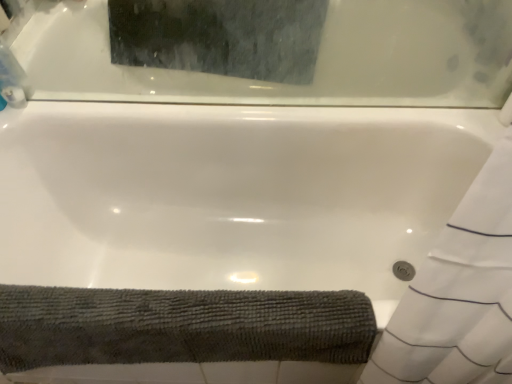
The width and height of the screenshot is (512, 384). I want to click on white glossy bathtub at upper center, so click(316, 63).

Find the location of a particular element. The height and width of the screenshot is (384, 512). dark gray textured bath towel at lower left is located at coordinates (180, 326).

The image size is (512, 384). Describe the element at coordinates (13, 79) in the screenshot. I see `clear plastic bottle at upper left` at that location.

Identify the location of white glossy bathtub at upper center. (316, 63).

Who is bigger, clear plastic bottle at upper left or white glossy bathtub at upper center?

With larger size is white glossy bathtub at upper center.

Looking at this image, from a real-world perspective, does clear plastic bottle at upper left sit lower than white glossy bathtub at upper center?

Indeed, from a real-world perspective, clear plastic bottle at upper left is positioned beneath white glossy bathtub at upper center.

Who is taller, clear plastic bottle at upper left or white glossy bathtub at upper center?

Standing taller between the two is white glossy bathtub at upper center.

Would you say clear plastic bottle at upper left is inside or outside dark gray textured bath towel at lower left?

The correct answer is: outside.

Which of these two, clear plastic bottle at upper left or dark gray textured bath towel at lower left, is thinner?

With smaller width is clear plastic bottle at upper left.

Is the position of clear plastic bottle at upper left more distant than that of dark gray textured bath towel at lower left?

Yes, it is behind dark gray textured bath towel at lower left.

Based on their positions, is clear plastic bottle at upper left located to the left or right of dark gray textured bath towel at lower left?

From the image, it's evident that clear plastic bottle at upper left is to the left of dark gray textured bath towel at lower left.

Considering the relative sizes of dark gray textured bath towel at lower left and clear plastic bottle at upper left in the image provided, is dark gray textured bath towel at lower left bigger than clear plastic bottle at upper left?

Yes.

In the scene shown: Does dark gray textured bath towel at lower left contain clear plastic bottle at upper left?

Actually, clear plastic bottle at upper left is outside dark gray textured bath towel at lower left.

How much distance is there between dark gray textured bath towel at lower left and clear plastic bottle at upper left?

The distance of dark gray textured bath towel at lower left from clear plastic bottle at upper left is 86.49 centimeters.

From a real-world perspective, is dark gray textured bath towel at lower left positioned under clear plastic bottle at upper left based on gravity?

Yes, from a real-world perspective, dark gray textured bath towel at lower left is beneath clear plastic bottle at upper left.

Between dark gray textured bath towel at lower left and white glossy bathtub at upper center, which one has more height?

Standing taller between the two is white glossy bathtub at upper center.

Does point (223, 320) appear closer or farther from the camera than point (452, 5)?

Clearly, point (223, 320) is closer to the camera than point (452, 5).

Can we say dark gray textured bath towel at lower left lies outside white glossy bathtub at upper center?

Yes, dark gray textured bath towel at lower left is not within white glossy bathtub at upper center.

From a real-world perspective, which object stands above the other?

white glossy bathtub at upper center, from a real-world perspective.

Is white glossy bathtub at upper center not close to dark gray textured bath towel at lower left?

Actually, white glossy bathtub at upper center and dark gray textured bath towel at lower left are a little close together.

Is white glossy bathtub at upper center outside of dark gray textured bath towel at lower left?

Yes, white glossy bathtub at upper center is located beyond the bounds of dark gray textured bath towel at lower left.

From the image's perspective, relative to clear plastic bottle at upper left, is white glossy bathtub at upper center above or below?

white glossy bathtub at upper center is above clear plastic bottle at upper left.

From a real-world perspective, is white glossy bathtub at upper center above or below clear plastic bottle at upper left?

white glossy bathtub at upper center is above clear plastic bottle at upper left.

Is white glossy bathtub at upper center turned away from clear plastic bottle at upper left?

Yes, clear plastic bottle at upper left is at the back of white glossy bathtub at upper center.

Would you say white glossy bathtub at upper center is outside clear plastic bottle at upper left?

white glossy bathtub at upper center lies outside clear plastic bottle at upper left's area.

This screenshot has height=384, width=512. I want to click on bathtub on the right of clear plastic bottle at upper left, so click(316, 63).

Identify the location of bath towel lying in front of the clear plastic bottle at upper left. (180, 326).

Looking at the image, which one is located closer to clear plastic bottle at upper left, dark gray textured bath towel at lower left or white glossy bathtub at upper center?

Among the two, white glossy bathtub at upper center is located nearer to clear plastic bottle at upper left.

Estimate the real-world distances between objects in this image. Which object is closer to dark gray textured bath towel at lower left, white glossy bathtub at upper center or clear plastic bottle at upper left?

The object closer to dark gray textured bath towel at lower left is white glossy bathtub at upper center.

Based on their spatial positions, is clear plastic bottle at upper left or white glossy bathtub at upper center further from dark gray textured bath towel at lower left?

The object further to dark gray textured bath towel at lower left is clear plastic bottle at upper left.

From the picture: Estimate the real-world distances between objects in this image. Which object is further from white glossy bathtub at upper center, dark gray textured bath towel at lower left or clear plastic bottle at upper left?

Among the two, dark gray textured bath towel at lower left is located further to white glossy bathtub at upper center.

Considering their positions, is clear plastic bottle at upper left positioned closer to white glossy bathtub at upper center than dark gray textured bath towel at lower left?

clear plastic bottle at upper left is positioned closer to the anchor white glossy bathtub at upper center.

From the image, which object appears to be nearer to clear plastic bottle at upper left, white glossy bathtub at upper center or dark gray textured bath towel at lower left?

white glossy bathtub at upper center is closer to clear plastic bottle at upper left.

This screenshot has width=512, height=384. Identify the location of cleaning product between white glossy bathtub at upper center and dark gray textured bath towel at lower left from top to bottom. (13, 79).